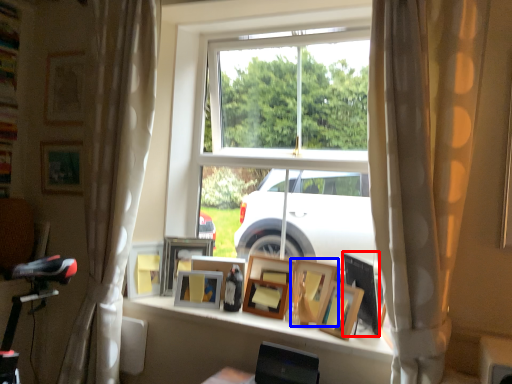
Question: Which of the following is the closest to the observer, picture frame (highlighted by a red box) or picture frame (highlighted by a blue box)?

Choices:
 (A) picture frame
 (B) picture frame

Answer: (A)